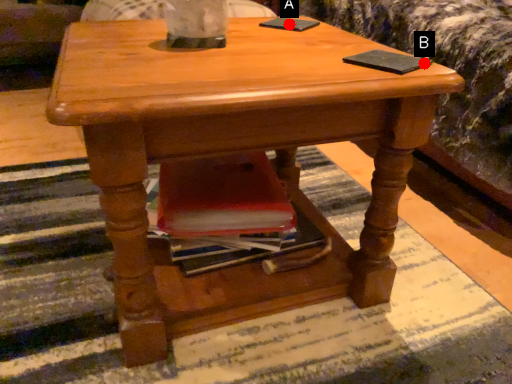
Question: Two points are circled on the image, labeled by A and B beside each circle. Which point is closer to the camera?

Choices:
 (A) A is closer
 (B) B is closer

Answer: (B)